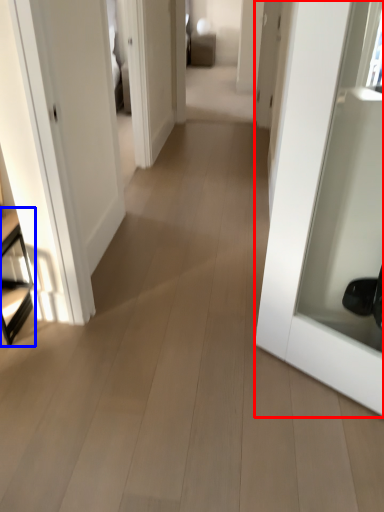
Question: Which object appears closest to the camera in this image, door (highlighted by a red box) or furniture (highlighted by a blue box)?

Choices:
 (A) door
 (B) furniture

Answer: (A)